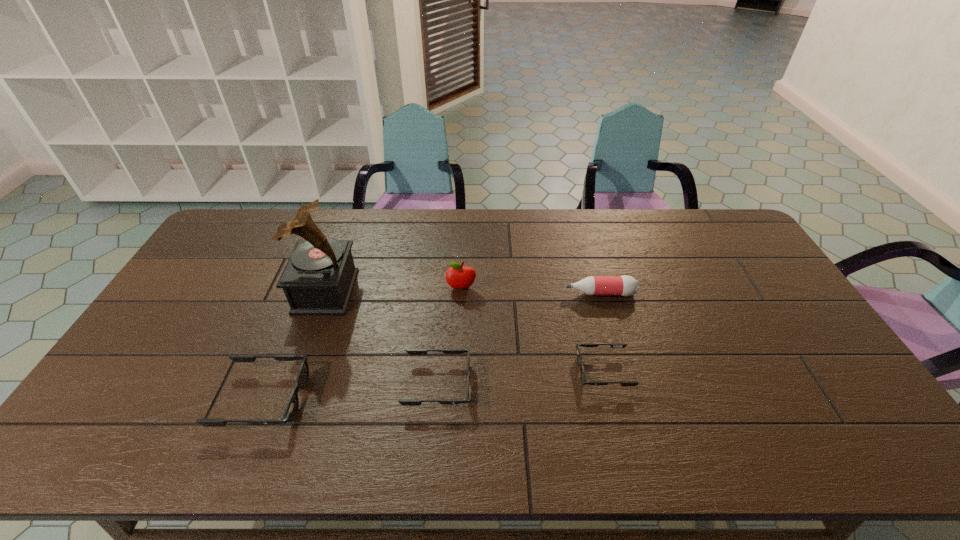
In order to click on the tallest sunglasses in this screenshot , I will do `click(291, 409)`.

This screenshot has height=540, width=960. I want to click on the second sunglasses from left to right, so click(405, 402).

Locate an element on the screen. Image resolution: width=960 pixels, height=540 pixels. the fifth tallest object is located at coordinates (405, 402).

Locate an element on the screen. The width and height of the screenshot is (960, 540). the shortest object is located at coordinates (613, 345).

You are a GUI agent. You are given a task and a screenshot of the screen. Output one action in this format:
    pyautogui.click(x=<x>, y=<y>)
    Task: Click on the shortest sunglasses
    This screenshot has height=540, width=960.
    Given the screenshot: What is the action you would take?
    pyautogui.click(x=613, y=345)

Locate an element on the screen. bottle is located at coordinates click(x=625, y=285).

The image size is (960, 540). What are the coordinates of `the second tallest object` in the screenshot? It's located at (458, 277).

The height and width of the screenshot is (540, 960). In order to click on the tallest object in this screenshot , I will do `click(318, 279)`.

Identify the location of vacant space located on the temples of the leftmost sunglasses. (332, 399).

I want to click on free space located on the temples of the second tallest sunglasses, so click(x=617, y=384).